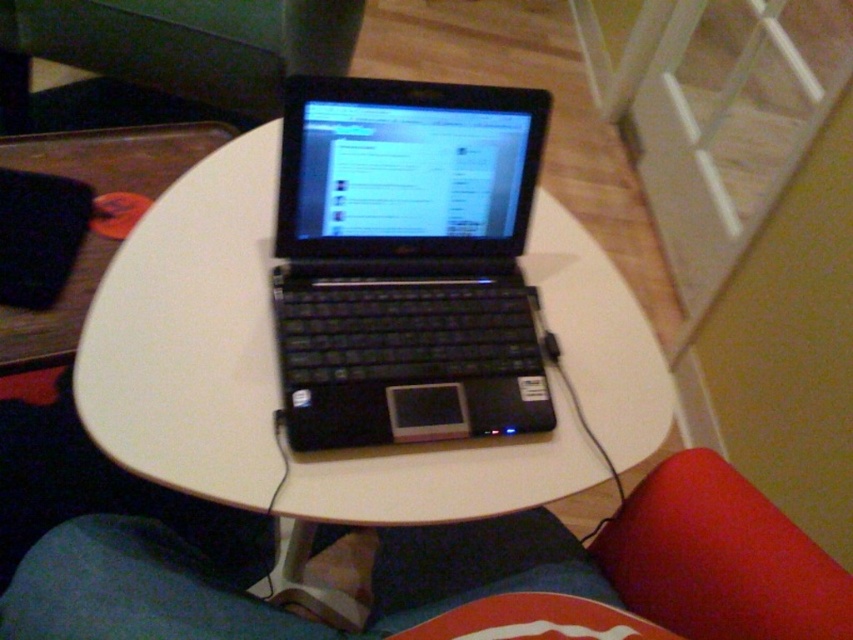
You are a delivery person who needs to place a rectangular package that measures 10 centimeters in length on the white matte round table at center without it overlapping the black matte laptop at center. Is this possible?

The white matte round table at center and black matte laptop at center are 9.74 centimeters apart. Since the package is 10 centimeters long, it would overlap the black matte laptop at center when placed on the table.

You are standing in the room where the white matte round table at center is located. If you face the table and look towards its center, which direction would you be facing relative to the room?

The white matte round table at center is positioned at point (267, 376), so facing its center would mean facing the direction corresponding to those coordinates in the room.